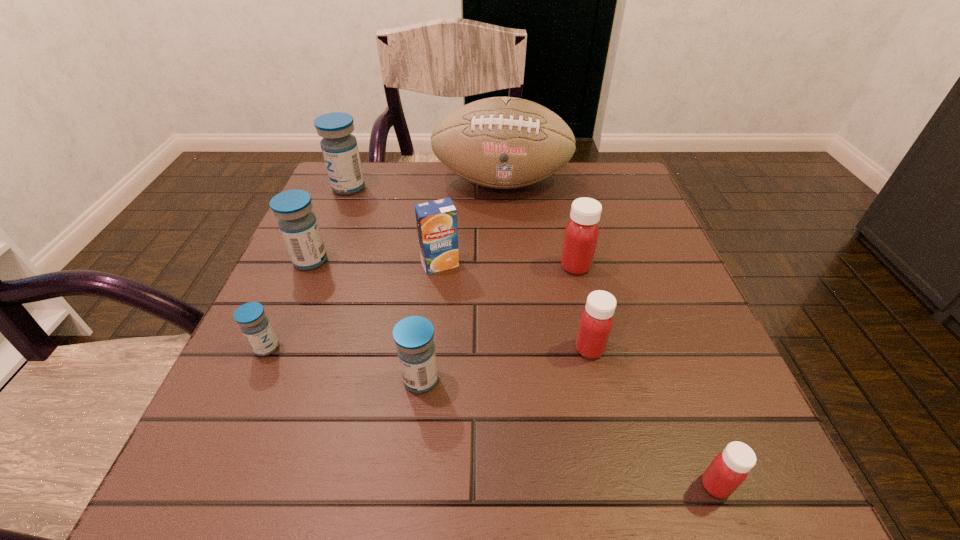
The width and height of the screenshot is (960, 540). In order to click on vacant position located 0.070m on the left of the nearest medicine in this screenshot , I will do `click(649, 485)`.

Where is `football (American) that is positioned at the far edge`? The width and height of the screenshot is (960, 540). football (American) that is positioned at the far edge is located at coordinates [500, 142].

I want to click on medicine situated at the far edge, so click(x=339, y=147).

Image resolution: width=960 pixels, height=540 pixels. Identify the location of object that is at the near edge. (729, 469).

I want to click on object that is at the right edge, so click(x=729, y=469).

Where is `object positioned at the far left corner`? The height and width of the screenshot is (540, 960). object positioned at the far left corner is located at coordinates (339, 147).

At what (x,y) coordinates should I click in order to perform the action: click on object located in the near right corner section of the desktop. Please return your answer as a coordinate pair (x, y). This screenshot has width=960, height=540. Looking at the image, I should click on pos(729,469).

In the image, there is a desktop. What are the coordinates of `blank space at the near edge` in the screenshot? It's located at (443, 441).

Image resolution: width=960 pixels, height=540 pixels. In order to click on vacant space at the left edge in this screenshot , I will do `click(290, 284)`.

Image resolution: width=960 pixels, height=540 pixels. What are the coordinates of `vacant space at the right edge of the desktop` in the screenshot? It's located at (707, 329).